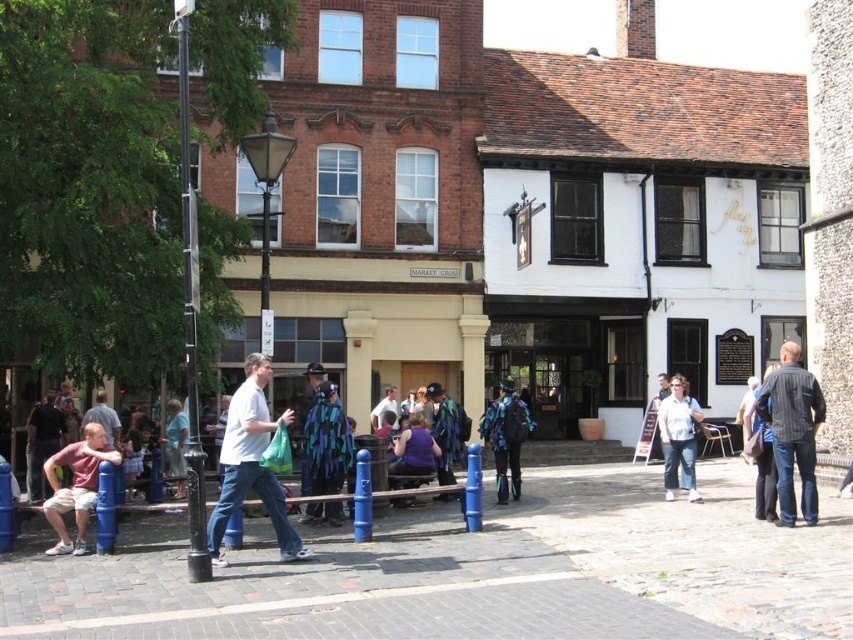
Which is more to the right, white shirt at center or dark blue jeans at center?

dark blue jeans at center is more to the right.

Is white shirt at center positioned in front of dark blue jeans at center?

That is False.

Which is behind, point (664, 420) or point (767, 445)?

The point (664, 420) is behind.

The height and width of the screenshot is (640, 853). In order to click on white shirt at center in this screenshot , I will do `click(677, 436)`.

Does brick pavement at center appear over shiny metallic jacket at center?

Actually, brick pavement at center is below shiny metallic jacket at center.

The width and height of the screenshot is (853, 640). In order to click on brick pavement at center in this screenshot , I will do `click(480, 573)`.

Does brick pavement at center appear under black metal pole at left?

Indeed, brick pavement at center is positioned under black metal pole at left.

Is brick pavement at center wider than black metal pole at left?

Yes.

Locate an element on the screen. This screenshot has width=853, height=640. brick pavement at center is located at coordinates (480, 573).